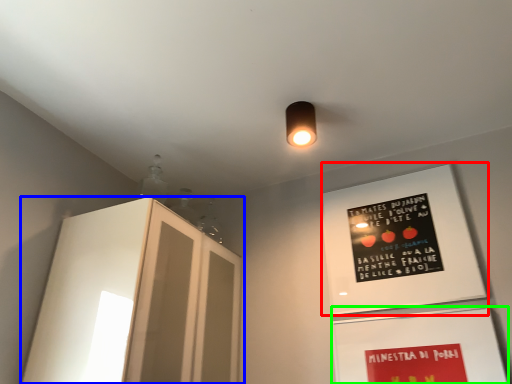
Question: Which object is the closest to the bulletin board (highlighted by a red box)? Choose among these: cabinetry (highlighted by a blue box) or bulletin board (highlighted by a green box).

Choices:
 (A) cabinetry
 (B) bulletin board

Answer: (B)